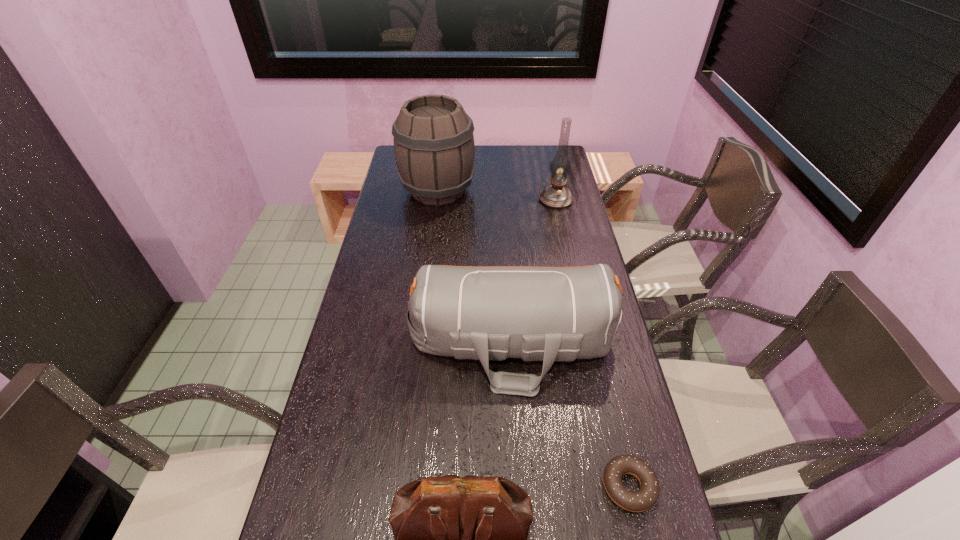
Where is `object that is the second nearest to the shortest object`? object that is the second nearest to the shortest object is located at coordinates (458, 539).

The width and height of the screenshot is (960, 540). I want to click on object that can be found as the second closest to the wine bucket, so click(x=552, y=314).

Find the location of `blank area in the image that satisfies the following two spatial constraints: 1. on the front side of the duffel bag; 2. on the right side of the wine bucket`. blank area in the image that satisfies the following two spatial constraints: 1. on the front side of the duffel bag; 2. on the right side of the wine bucket is located at coordinates (419, 342).